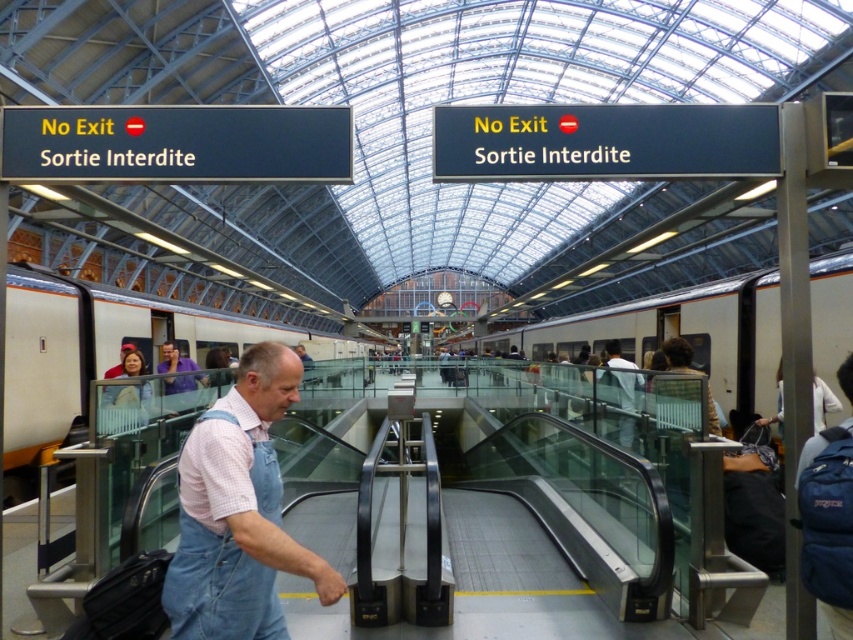
Question: Which of the following is the farthest from the observer?

Choices:
 (A) black fabric backpack at lower right
 (B) denim overalls at center

Answer: (A)

Question: Does black fabric backpack at lower right come in front of purple shirt at center?

Choices:
 (A) no
 (B) yes

Answer: (B)

Question: Among these points, which one is nearest to the camera?

Choices:
 (A) (x=173, y=344)
 (B) (x=218, y=481)
 (C) (x=769, y=536)

Answer: (B)

Question: Which of the following is the closest to the observer?

Choices:
 (A) (184, 528)
 (B) (195, 384)

Answer: (A)

Question: Is denim overalls at center positioned at the back of black fabric backpack at lower right?

Choices:
 (A) yes
 (B) no

Answer: (B)

Question: Is black fabric backpack at lower right thinner than purple shirt at center?

Choices:
 (A) yes
 (B) no

Answer: (A)